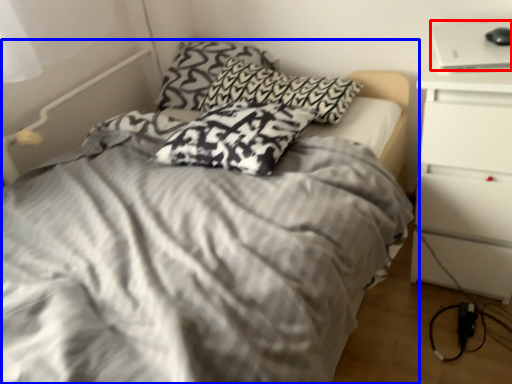
Question: Which of the following is the farthest to the observer, laptop (highlighted by a red box) or bed (highlighted by a blue box)?

Choices:
 (A) laptop
 (B) bed

Answer: (A)